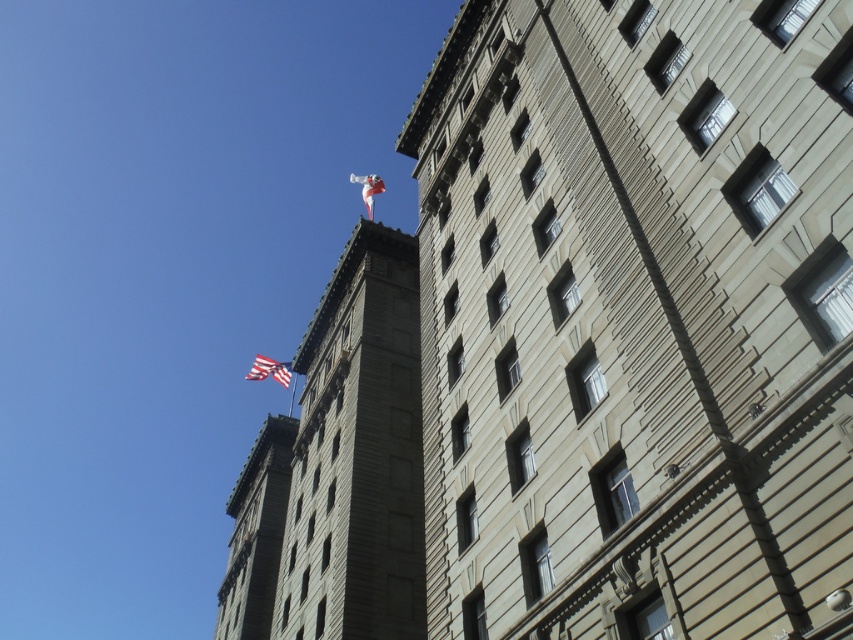
You are standing 50 meters away from the smooth stone tower at upper center. Can you safely approach it without exceeding the recommended safety distance of 50 meters?

The smooth stone tower at upper center is 51.24 meters away from the viewer, so approaching it would exceed the recommended safety distance of 50 meters. You should stay further back.

You are standing on the ground floor of the smooth stone tower at upper center and want to reach the white fabric flag at upper center. What direction should you move in to get there?

You should move upward since the smooth stone tower at upper center is positioned under the white fabric flag at upper center, meaning the flag is above the tower.

You are standing at the base of the smooth stone tower at upper center and the american flag at upper left. Which object would you need to look up higher to see?

The smooth stone tower at upper center is much taller than the american flag at upper left, so you would need to look up higher to see the smooth stone tower at upper center.